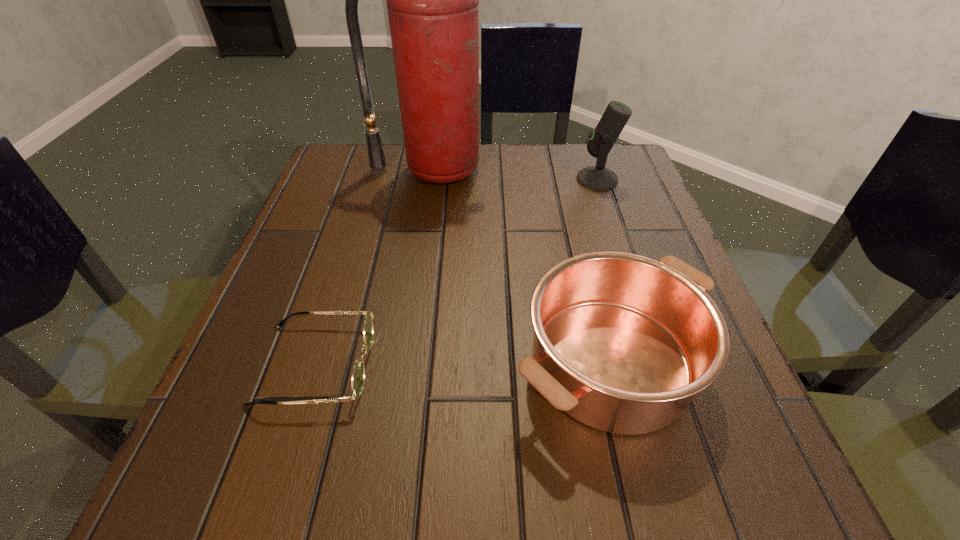
Find the location of a particular element. Image resolution: width=960 pixels, height=540 pixels. fire extinguisher is located at coordinates (432, 0).

Locate an element on the screen. microphone is located at coordinates (602, 139).

At what (x,y) coordinates should I click in order to perform the action: click on saucepan. Please return your answer as a coordinate pair (x, y). This screenshot has width=960, height=540. Looking at the image, I should click on (622, 343).

At what (x,y) coordinates should I click in order to perform the action: click on the shortest object. Please return your answer as a coordinate pair (x, y). Image resolution: width=960 pixels, height=540 pixels. Looking at the image, I should click on (358, 373).

Find the location of a particular element. free space located at the front of the fire extinguisher where the nozzle is aimed is located at coordinates (424, 222).

Locate an element on the screen. This screenshot has height=540, width=960. vacant region located 0.050m on the front of the second tallest object is located at coordinates (606, 204).

The width and height of the screenshot is (960, 540). Identify the location of free space located on the back of the second shortest object. (576, 221).

I want to click on vacant space located 0.290m on the lenses of the shortest object, so click(x=566, y=364).

The height and width of the screenshot is (540, 960). In order to click on fire extinguisher situated at the far edge in this screenshot , I will do `click(432, 0)`.

Where is `microphone at the far edge`? The image size is (960, 540). microphone at the far edge is located at coordinates (602, 139).